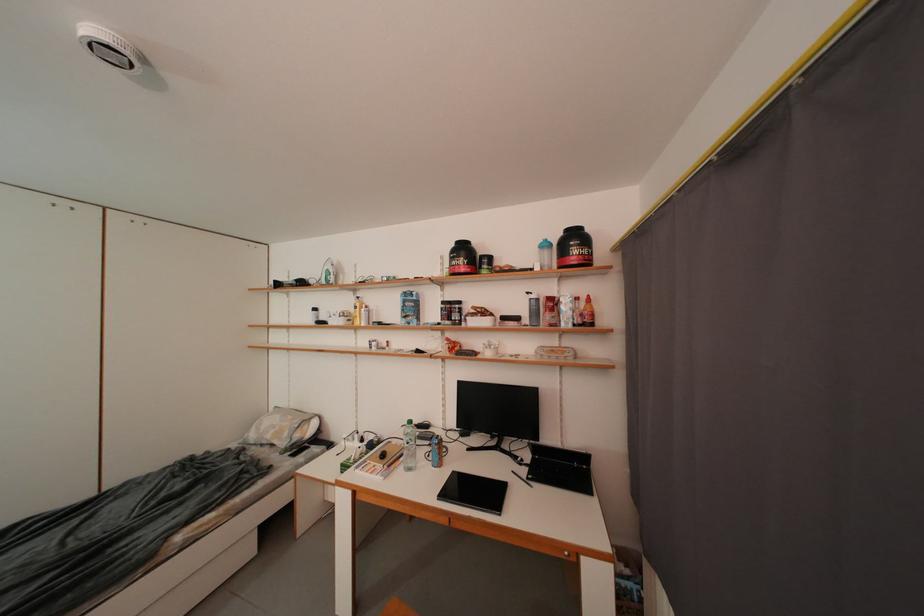
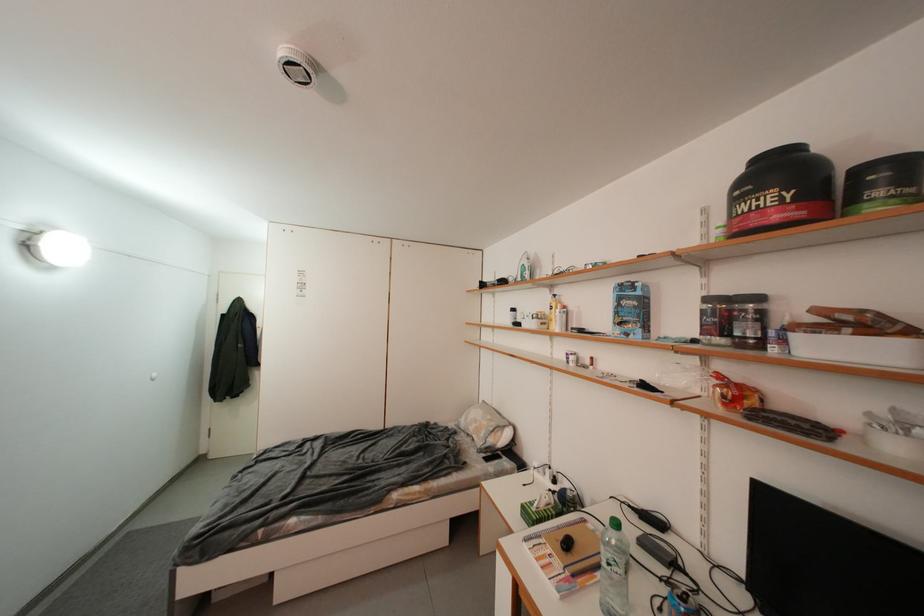
In the second image, find the point that corresponds to (x=349, y=468) in the first image.

(530, 509)